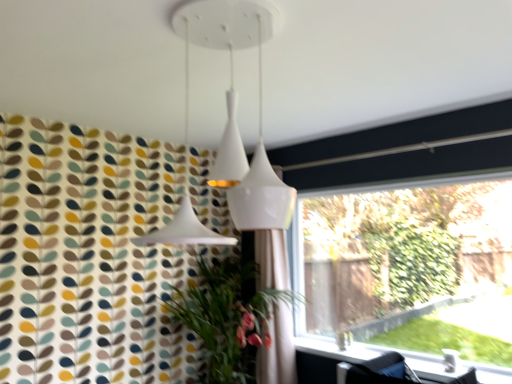
Question: Does white fabric shower curtain at center turn towards transparent glass window at right?

Choices:
 (A) yes
 (B) no

Answer: (B)

Question: From the image's perspective, is white fabric shower curtain at center located above transparent glass window at right?

Choices:
 (A) no
 (B) yes

Answer: (A)

Question: Does white fabric shower curtain at center have a smaller size compared to transparent glass window at right?

Choices:
 (A) no
 (B) yes

Answer: (B)

Question: Would you say white fabric shower curtain at center is a long distance from transparent glass window at right?

Choices:
 (A) no
 (B) yes

Answer: (B)

Question: Is white fabric shower curtain at center behind transparent glass window at right?

Choices:
 (A) no
 (B) yes

Answer: (B)

Question: Can you confirm if white fabric shower curtain at center is positioned to the left of transparent glass window at right?

Choices:
 (A) yes
 (B) no

Answer: (A)

Question: Is white fabric shower curtain at center next to white glossy window sill at lower right?

Choices:
 (A) no
 (B) yes

Answer: (A)

Question: Can you confirm if white fabric shower curtain at center is thinner than white glossy window sill at lower right?

Choices:
 (A) yes
 (B) no

Answer: (B)

Question: Can you confirm if white fabric shower curtain at center is positioned to the right of white glossy window sill at lower right?

Choices:
 (A) no
 (B) yes

Answer: (A)

Question: From the image's perspective, would you say white fabric shower curtain at center is positioned over white glossy window sill at lower right?

Choices:
 (A) yes
 (B) no

Answer: (A)

Question: Is white fabric shower curtain at center not within white glossy window sill at lower right?

Choices:
 (A) yes
 (B) no

Answer: (A)

Question: From a real-world perspective, does white fabric shower curtain at center sit lower than white glossy window sill at lower right?

Choices:
 (A) no
 (B) yes

Answer: (A)

Question: Does transparent glass window at right contain white fabric shower curtain at center?

Choices:
 (A) no
 (B) yes

Answer: (A)